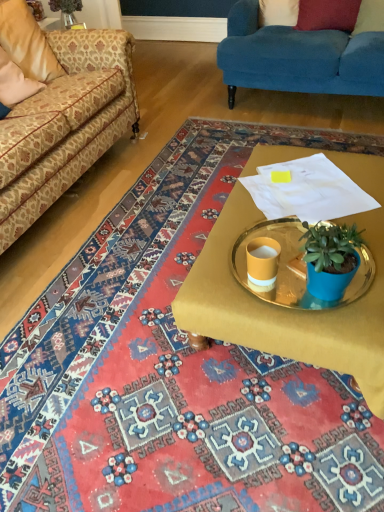
What are the coordinates of `vacant area situated to the left side of matte yellow cup at center` in the screenshot? It's located at (213, 285).